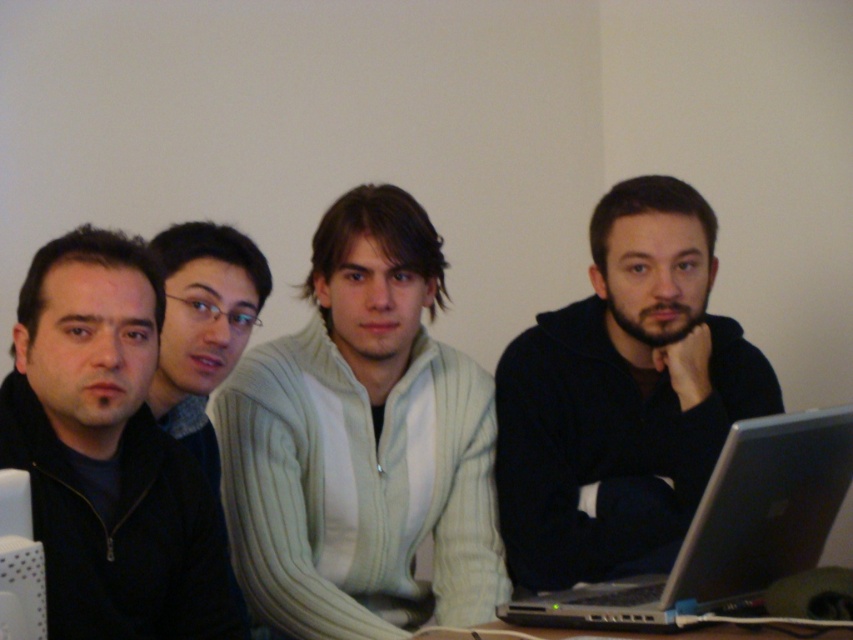
Can you confirm if dark matte jacket at left is positioned above white plastic computer at lower left?

Yes.

Who is lower down, dark matte jacket at left or white plastic computer at lower left?

Positioned lower is white plastic computer at lower left.

Which is behind, point (164, 563) or point (3, 486)?

The point (164, 563) is behind.

At what (x,y) coordinates should I click in order to perform the action: click on dark matte jacket at left. Please return your answer as a coordinate pair (x, y). This screenshot has height=640, width=853. Looking at the image, I should click on (108, 452).

Between black matte jacket at center and white plastic computer at lower left, which one appears on the right side from the viewer's perspective?

From the viewer's perspective, black matte jacket at center appears more on the right side.

Find the location of a particular element. Image resolution: width=853 pixels, height=640 pixels. black matte jacket at center is located at coordinates (622, 396).

In order to click on black matte jacket at center in this screenshot , I will do `click(622, 396)`.

Which is in front, point (659, 593) or point (30, 595)?

Positioned in front is point (30, 595).

Does silver metallic laptop at lower right have a lesser height compared to white plastic computer at lower left?

No, silver metallic laptop at lower right is not shorter than white plastic computer at lower left.

Locate an element on the screen. Image resolution: width=853 pixels, height=640 pixels. silver metallic laptop at lower right is located at coordinates (727, 531).

The height and width of the screenshot is (640, 853). I want to click on silver metallic laptop at lower right, so click(727, 531).